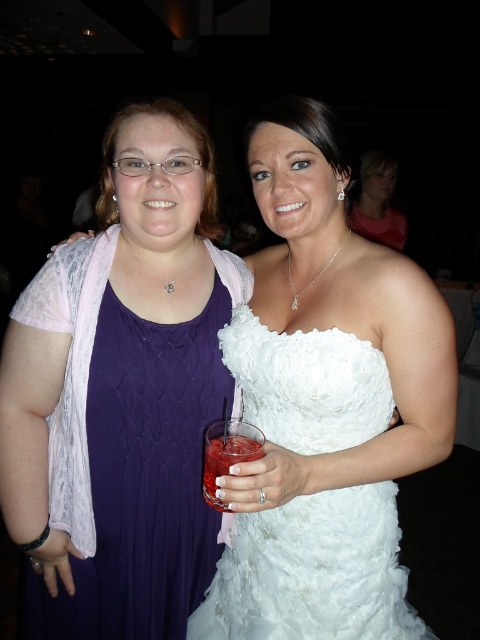
Does white lace dress at center have a lesser height compared to translucent glass drink at center?

No, white lace dress at center is not shorter than translucent glass drink at center.

You are a GUI agent. You are given a task and a screenshot of the screen. Output one action in this format:
    pyautogui.click(x=<x>, y=<y>)
    Task: Click on the white lace dress at center
    The width and height of the screenshot is (480, 640).
    Given the screenshot: What is the action you would take?
    pyautogui.click(x=312, y=572)

Measure the distance between point (184,522) and camera.

A distance of 1.10 meters exists between point (184,522) and camera.

How distant is purple knit dress at left from translucent glass drink at center?

The distance of purple knit dress at left from translucent glass drink at center is 28.58 centimeters.

Locate an element on the screen. This screenshot has width=480, height=640. purple knit dress at left is located at coordinates (129, 449).

Locate an element on the screen. The height and width of the screenshot is (640, 480). purple knit dress at left is located at coordinates (129, 449).

Can you confirm if white lace dress at center is shorter than matte white dress at upper center?

In fact, white lace dress at center may be taller than matte white dress at upper center.

Who is taller, white lace dress at center or matte white dress at upper center?

Standing taller between the two is white lace dress at center.

Is point (289, 577) closer to viewer compared to point (357, 198)?

Yes, it is.

What are the coordinates of `white lace dress at center` in the screenshot? It's located at 312,572.